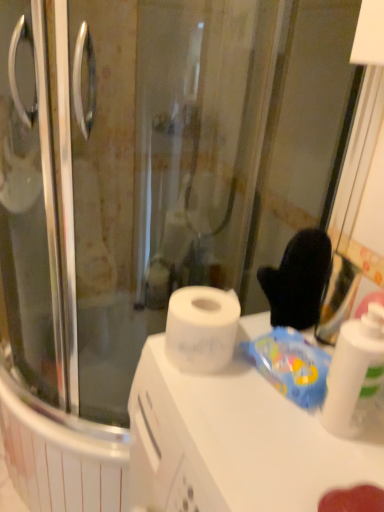
Identify the location of vacant space situated above white matte counter top at center (from a real-world perspective). (248, 408).